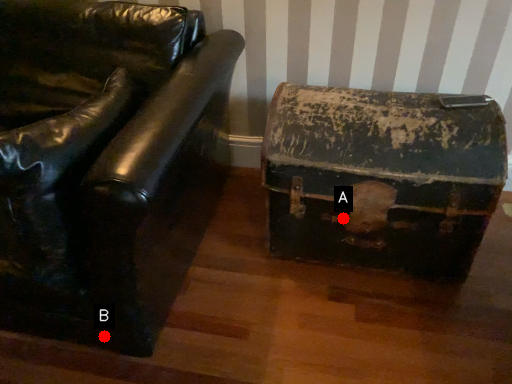
Question: Two points are circled on the image, labeled by A and B beside each circle. Among these points, which one is farthest from the camera?

Choices:
 (A) A is further
 (B) B is further

Answer: (A)